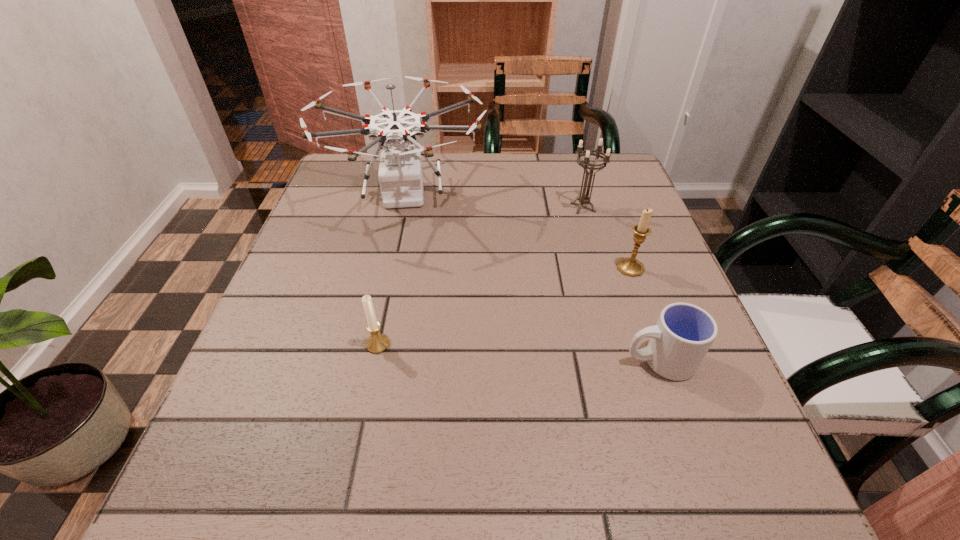
Where is `vacant space located with the handle on the side of the shortest object`? The width and height of the screenshot is (960, 540). vacant space located with the handle on the side of the shortest object is located at coordinates (536, 361).

At what (x,y) coordinates should I click in order to perform the action: click on free space located 0.320m with the handle on the side of the shortest object. Please return your answer as a coordinate pair (x, y). This screenshot has width=960, height=540. Looking at the image, I should click on (437, 361).

Where is `vacant space located 0.100m with the handle on the side of the shortest object`? The width and height of the screenshot is (960, 540). vacant space located 0.100m with the handle on the side of the shortest object is located at coordinates (565, 361).

This screenshot has height=540, width=960. In order to click on drone situated at the far edge in this screenshot , I will do `click(400, 174)`.

Locate an element on the screen. The image size is (960, 540). candle holder present at the far edge is located at coordinates (584, 199).

This screenshot has height=540, width=960. I want to click on object located at the left edge, so click(400, 174).

Locate an element on the screen. The width and height of the screenshot is (960, 540). cup situated at the right edge is located at coordinates (684, 332).

The image size is (960, 540). I want to click on object positioned at the far left corner, so tap(400, 174).

Identify the location of object at the far right corner. (584, 199).

The height and width of the screenshot is (540, 960). In the image, there is a desktop. Find the location of `vacant space at the far edge`. vacant space at the far edge is located at coordinates (476, 165).